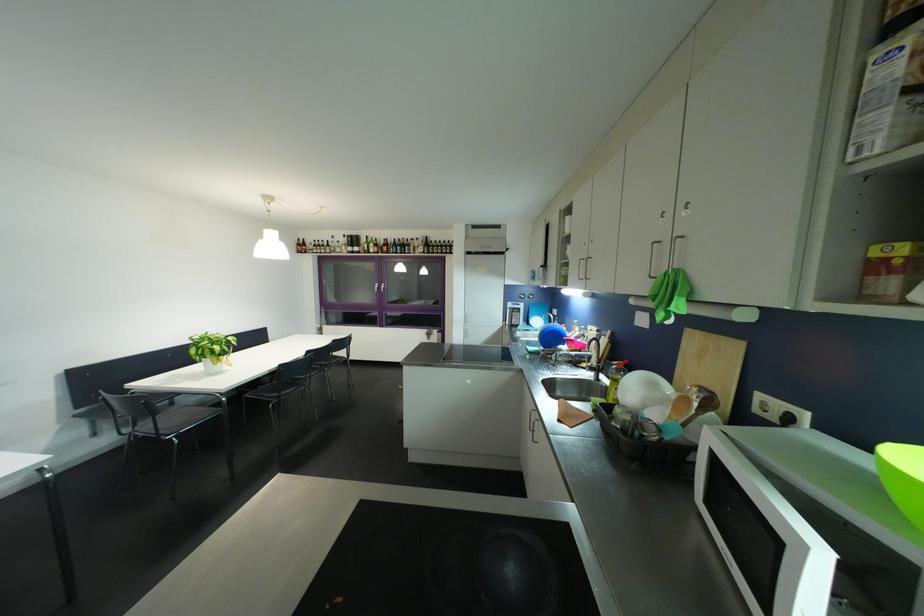
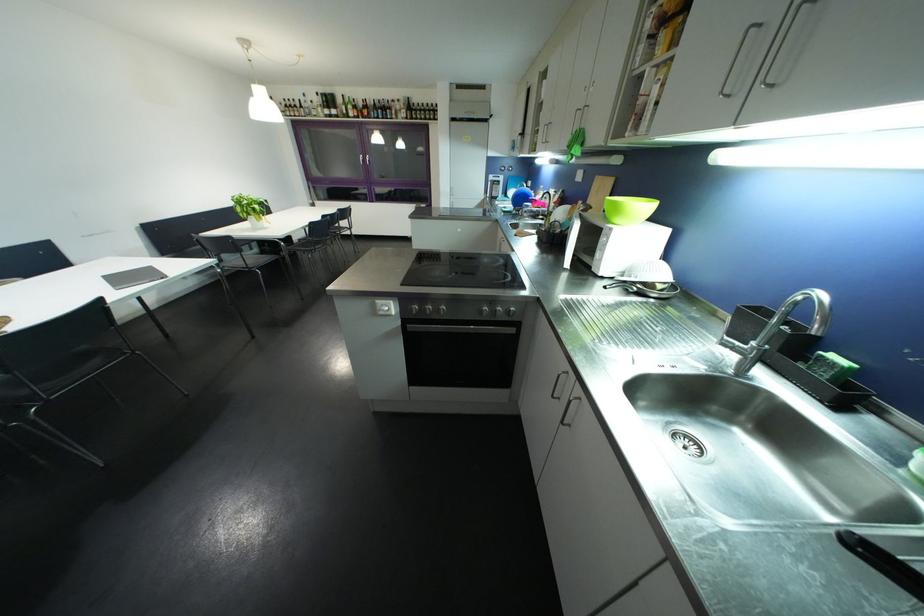
The point at (160, 416) is marked in the first image. Where is the corresponding point in the second image?

(247, 253)